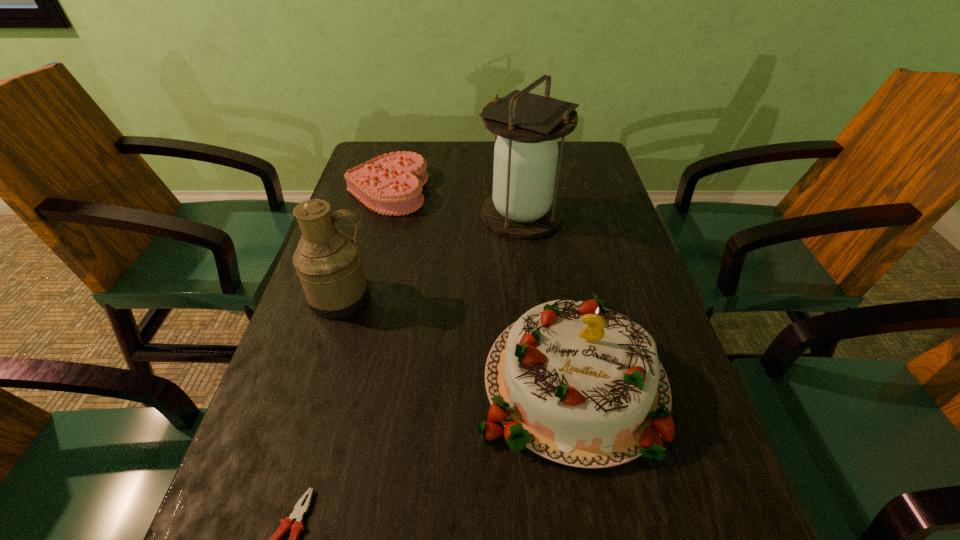
Identify the location of object present at the far edge. This screenshot has height=540, width=960. (391, 184).

Image resolution: width=960 pixels, height=540 pixels. I want to click on pitcher that is at the left edge, so point(327,261).

In order to click on cake that is at the left edge in this screenshot , I will do `click(391, 184)`.

Where is `lantern situated at the right edge`? This screenshot has width=960, height=540. lantern situated at the right edge is located at coordinates (523, 205).

What are the coordinates of `cake present at the right edge` in the screenshot? It's located at (581, 385).

What are the coordinates of `object that is positioned at the far left corner` in the screenshot? It's located at (391, 184).

Where is `vacant region at the left edge of the desktop`? vacant region at the left edge of the desktop is located at coordinates (336, 470).

Locate an element on the screen. The width and height of the screenshot is (960, 540). free region at the right edge is located at coordinates (628, 248).

Identify the location of vacant area at the far left corner of the desktop. (362, 153).

Locate an element on the screen. The width and height of the screenshot is (960, 540). empty space that is in between the fourth shortest object and the second shortest object is located at coordinates (364, 244).